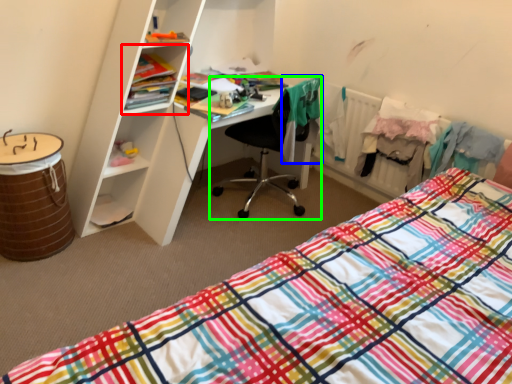
Question: Considering the real-world distances, which object is closest to cabinet (highlighted by a red box)? clothing (highlighted by a blue box) or chair (highlighted by a green box).

Choices:
 (A) clothing
 (B) chair

Answer: (B)